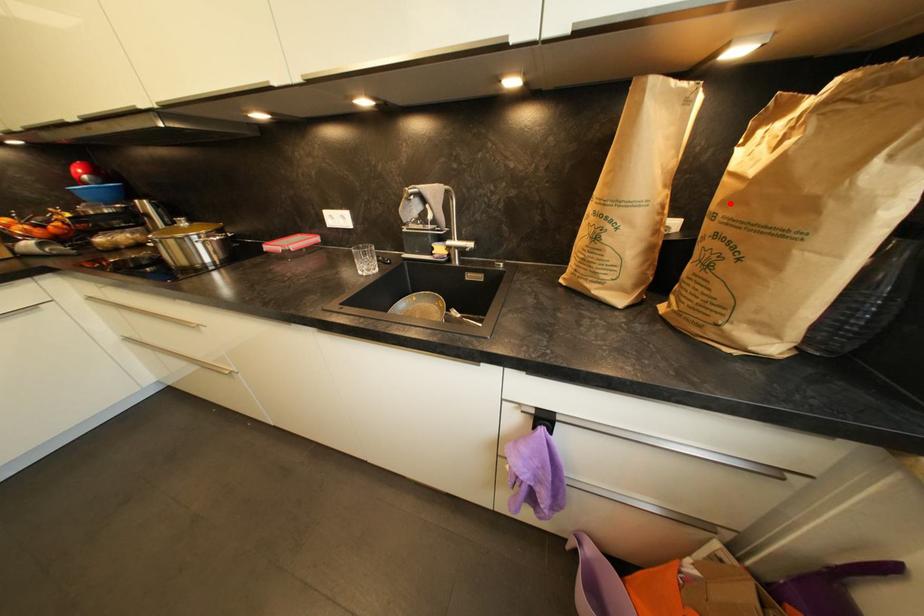
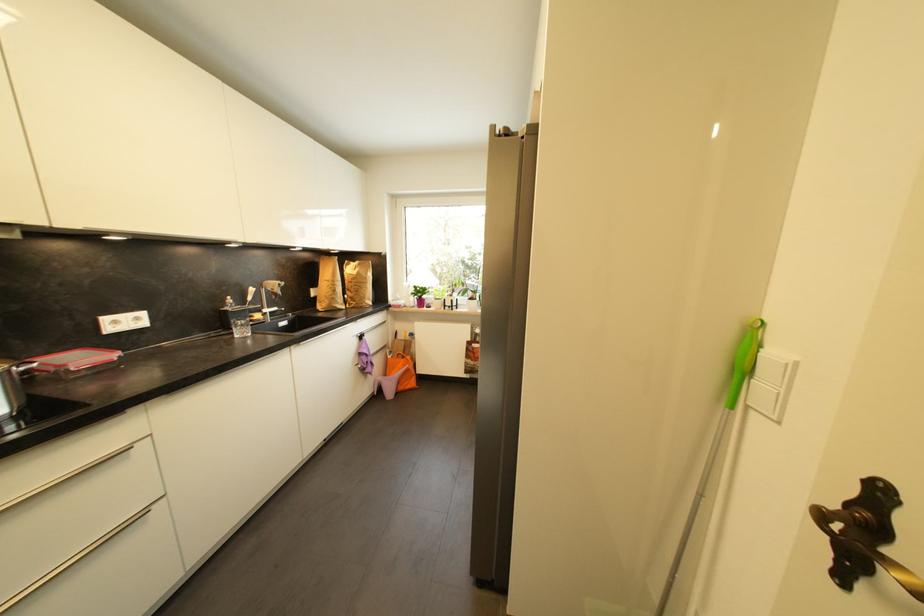
Question: A red point is marked in image1. In image2, is the corresponding 3D point closer to the camera or farther? Reply with the corresponding letter.

Choices:
 (A) The corresponding 3D point is closer.
 (B) The corresponding 3D point is farther.

Answer: (A)